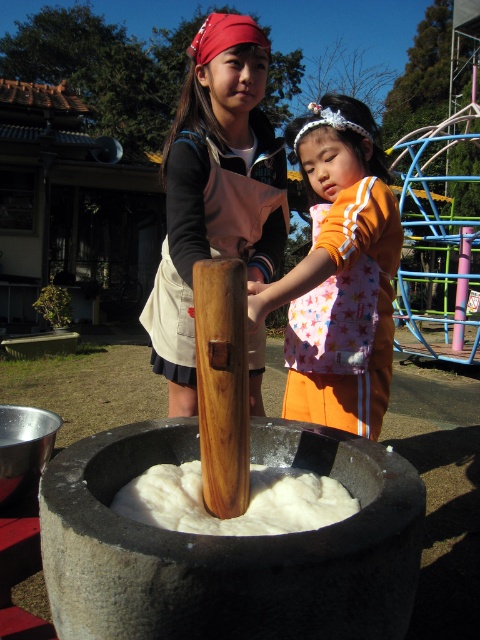
Question: Is the position of orange fabric dress at center more distant than that of white fluffy flour at center?

Choices:
 (A) no
 (B) yes

Answer: (B)

Question: Does wooden pestle at center lie in front of white fluffy flour at center?

Choices:
 (A) no
 (B) yes

Answer: (A)

Question: Which point is closer to the camera?

Choices:
 (A) wooden pestle at center
 (B) orange fabric dress at center
 (C) white fluffy flour at center
 (D) wooden rolling pin at center

Answer: (C)

Question: Is wooden pestle at center smaller than metallic silver basin at lower left?

Choices:
 (A) yes
 (B) no

Answer: (B)

Question: Among these points, which one is nearest to the camera?

Choices:
 (A) (237, 230)
 (B) (206, 509)

Answer: (B)

Question: Which object is the closest to the wooden pestle at center?

Choices:
 (A) metallic silver basin at lower left
 (B) wooden rolling pin at center
 (C) white fluffy flour at center
 (D) orange fabric dress at center

Answer: (D)